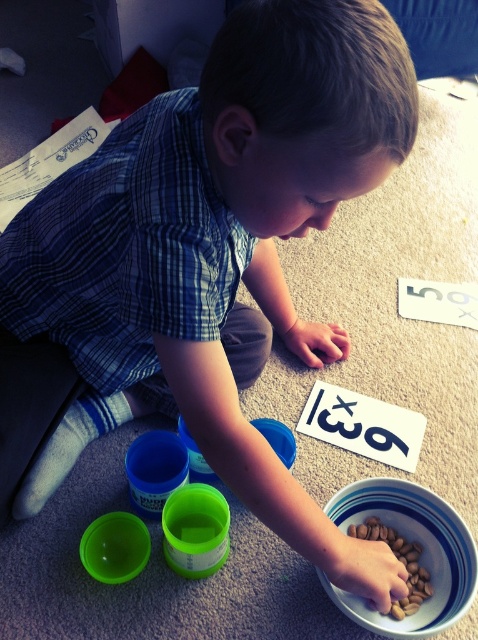
Question: Which point is closer to the camera taking this photo?

Choices:
 (A) (416, 621)
 (B) (408, 570)

Answer: (A)

Question: Is white glossy bowl at lower center bigger than brown matte nuts at lower center?

Choices:
 (A) no
 (B) yes

Answer: (B)

Question: Can you confirm if white glossy bowl at lower center is positioned to the right of brown matte nuts at lower center?

Choices:
 (A) yes
 (B) no

Answer: (B)

Question: In this image, where is white glossy bowl at lower center located relative to brown matte nuts at lower center?

Choices:
 (A) above
 (B) below

Answer: (A)